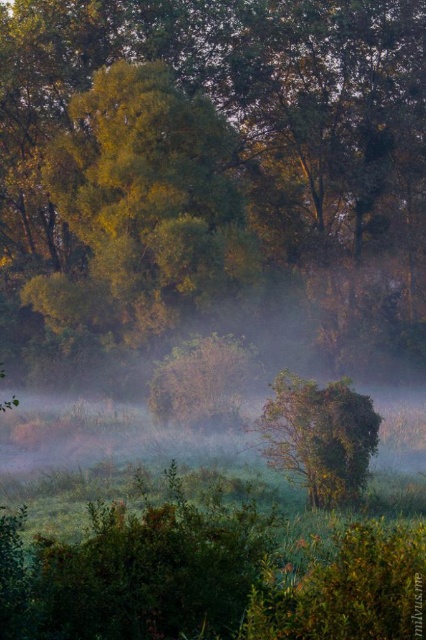
Does green leafy tree at upper left come behind green leafy tree at center?

Yes.

Between point (91, 237) and point (339, 461), which one is positioned behind?

Point (91, 237)

At what (x,y) coordinates should I click in order to perform the action: click on green leafy tree at upper left. Please return your answer as a coordinate pair (x, y). Image resolution: width=426 pixels, height=640 pixels. Looking at the image, I should click on (143, 205).

Is green leafy tree at upper center thinner than green leafy tree at center?

Incorrect, green leafy tree at upper center's width is not less than green leafy tree at center's.

Who is positioned more to the left, green leafy tree at upper center or green leafy tree at center?

green leafy tree at upper center is more to the left.

The width and height of the screenshot is (426, 640). What do you see at coordinates (224, 147) in the screenshot? I see `green leafy tree at upper center` at bounding box center [224, 147].

Locate an element on the screen. This screenshot has height=640, width=426. green leafy tree at upper center is located at coordinates (224, 147).

In the scene shown: Is green leafy tree at upper center bigger than green leafy tree at upper left?

Correct, green leafy tree at upper center is larger in size than green leafy tree at upper left.

I want to click on green leafy tree at upper center, so click(224, 147).

Find the location of a particular element. The image size is (426, 640). green leafy tree at upper center is located at coordinates [224, 147].